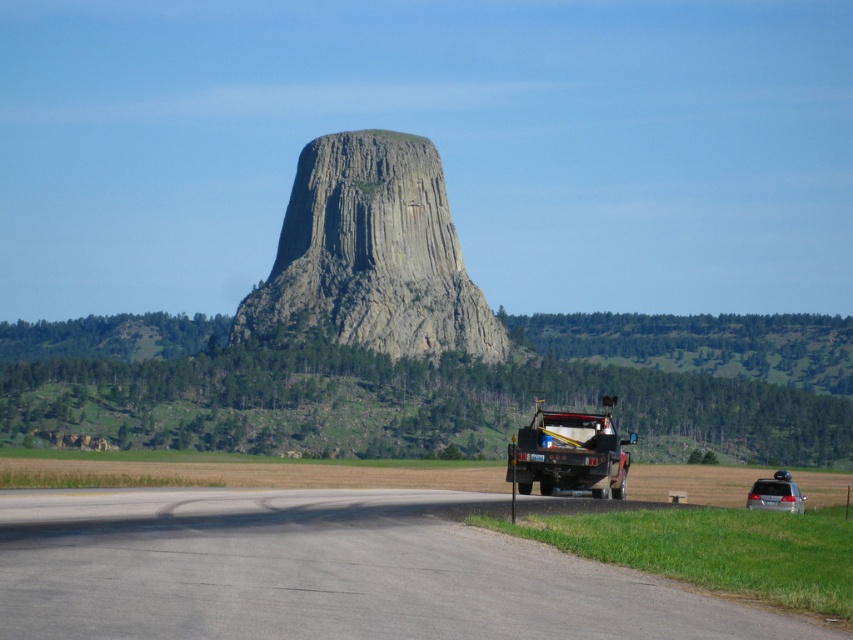
Between gray asphalt highway at center and brushed metal tow truck at center, which one has less height?

With less height is gray asphalt highway at center.

What do you see at coordinates (325, 572) in the screenshot? I see `gray asphalt highway at center` at bounding box center [325, 572].

What are the coordinates of `gray asphalt highway at center` in the screenshot? It's located at (325, 572).

Between gray asphalt highway at center and gray rock formation at center, which one is positioned higher?

gray rock formation at center is higher up.

Does point (650, 593) come behind point (431, 189)?

No, it is in front of (431, 189).

Where is `gray asphalt highway at center`? This screenshot has height=640, width=853. gray asphalt highway at center is located at coordinates (325, 572).

Looking at this image, can you confirm if brushed metal tow truck at center is positioned to the left of satin silver sedan at lower right?

Correct, you'll find brushed metal tow truck at center to the left of satin silver sedan at lower right.

Does brushed metal tow truck at center have a greater width compared to satin silver sedan at lower right?

Yes.

Is point (602, 400) more distant than point (770, 499)?

Yes, it is behind point (770, 499).

What are the coordinates of `brushed metal tow truck at center` in the screenshot? It's located at (570, 452).